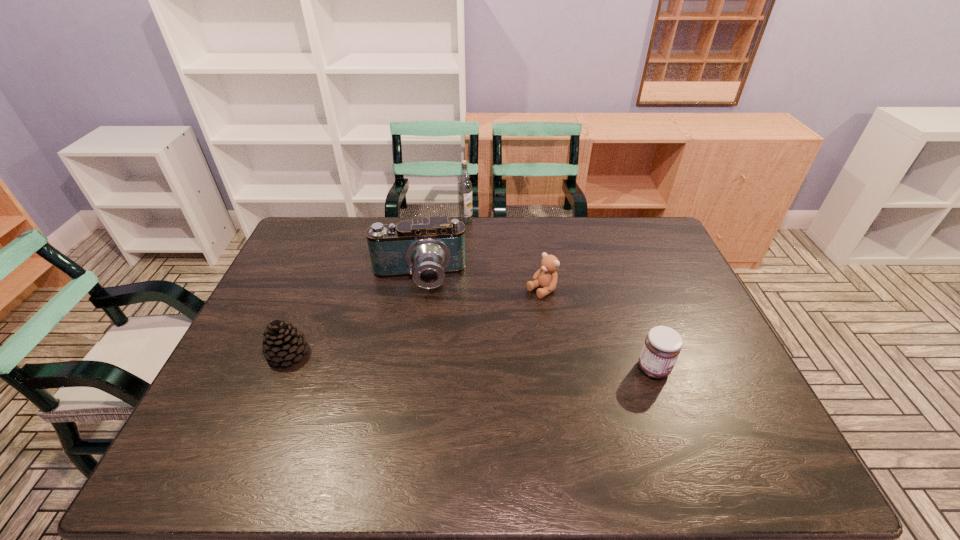
Image resolution: width=960 pixels, height=540 pixels. Identify the location of free spot between the rightmost object and the leftmost object. (470, 361).

Locate an element on the screen. free space between the rightmost object and the leftmost object is located at coordinates (470, 361).

Find the location of a particular element. Image resolution: width=960 pixels, height=540 pixels. free space between the teddy bear and the jam is located at coordinates (597, 329).

Find the location of `empty space that is in between the fourth object from left to right and the farthest object`. empty space that is in between the fourth object from left to right and the farthest object is located at coordinates (503, 255).

Where is `object that can be found as the fourth closest to the tallest object`? object that can be found as the fourth closest to the tallest object is located at coordinates (662, 346).

This screenshot has height=540, width=960. In order to click on object that is the closest one to the vodka in this screenshot , I will do `click(427, 249)`.

I want to click on free space that satisfies the following two spatial constraints: 1. on the front side of the second tallest object; 2. on the front label of the jam, so click(x=404, y=368).

Image resolution: width=960 pixels, height=540 pixels. In order to click on vacant space that satisfies the following two spatial constraints: 1. on the front side of the fourth object from left to right; 2. on the front label of the rightmost object in this screenshot , I will do `click(553, 368)`.

Where is `vacant space that satisfies the following two spatial constraints: 1. on the front side of the jam; 2. on the front label of the farthest object`? This screenshot has width=960, height=540. vacant space that satisfies the following two spatial constraints: 1. on the front side of the jam; 2. on the front label of the farthest object is located at coordinates (459, 368).